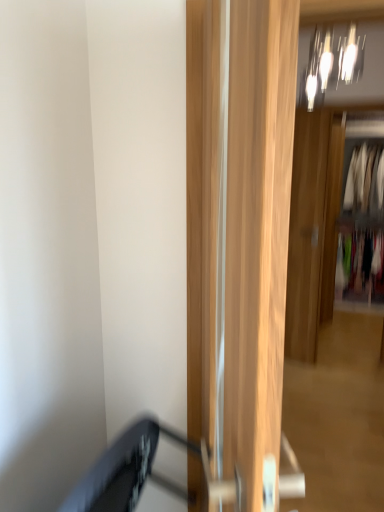
The width and height of the screenshot is (384, 512). In order to click on free point below metallic glass light fixture at upper center (from a real-world perspective) in this screenshot , I will do `click(319, 447)`.